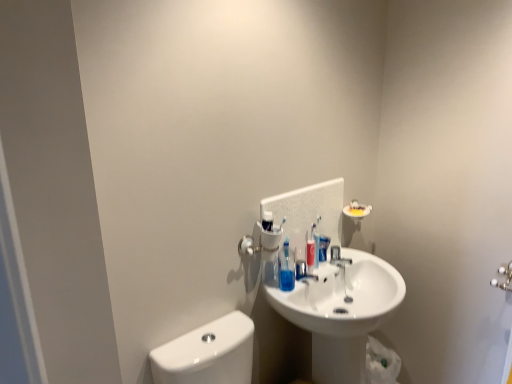
Question: From a real-world perspective, is satin nickel faucet at center located beneath translucent plastic soap dispenser at center?

Choices:
 (A) yes
 (B) no

Answer: (A)

Question: Is satin nickel faucet at center far from translucent plastic soap dispenser at center?

Choices:
 (A) yes
 (B) no

Answer: (B)

Question: Is satin nickel faucet at center facing towards translucent plastic soap dispenser at center?

Choices:
 (A) yes
 (B) no

Answer: (B)

Question: From the image's perspective, does satin nickel faucet at center appear lower than translucent plastic soap dispenser at center?

Choices:
 (A) yes
 (B) no

Answer: (A)

Question: From the image's perspective, does satin nickel faucet at center appear higher than translucent plastic soap dispenser at center?

Choices:
 (A) yes
 (B) no

Answer: (B)

Question: Is translucent plastic soap dispenser at center in front of or behind blue glossy mouthwash at center in the image?

Choices:
 (A) front
 (B) behind

Answer: (A)

Question: From the image's perspective, is translucent plastic soap dispenser at center above or below blue glossy mouthwash at center?

Choices:
 (A) above
 (B) below

Answer: (B)

Question: Is translucent plastic soap dispenser at center taller or shorter than blue glossy mouthwash at center?

Choices:
 (A) short
 (B) tall

Answer: (B)

Question: Visually, is translucent plastic soap dispenser at center positioned to the left or to the right of blue glossy mouthwash at center?

Choices:
 (A) right
 (B) left

Answer: (B)

Question: From a real-world perspective, relative to translucent plastic soap dispenser at center, is satin nickel faucet at center vertically above or below?

Choices:
 (A) below
 (B) above

Answer: (A)

Question: From the image's perspective, is satin nickel faucet at center positioned above or below translucent plastic soap dispenser at center?

Choices:
 (A) above
 (B) below

Answer: (B)

Question: Is satin nickel faucet at center bigger or smaller than translucent plastic soap dispenser at center?

Choices:
 (A) small
 (B) big

Answer: (A)

Question: Considering the positions of satin nickel faucet at center and translucent plastic soap dispenser at center in the image, is satin nickel faucet at center taller or shorter than translucent plastic soap dispenser at center?

Choices:
 (A) tall
 (B) short

Answer: (B)

Question: Considering the positions of white glossy sink at center and blue glossy mouthwash at center in the image, is white glossy sink at center taller or shorter than blue glossy mouthwash at center?

Choices:
 (A) short
 (B) tall

Answer: (B)

Question: Is white glossy sink at center in front of or behind blue glossy mouthwash at center in the image?

Choices:
 (A) front
 (B) behind

Answer: (A)